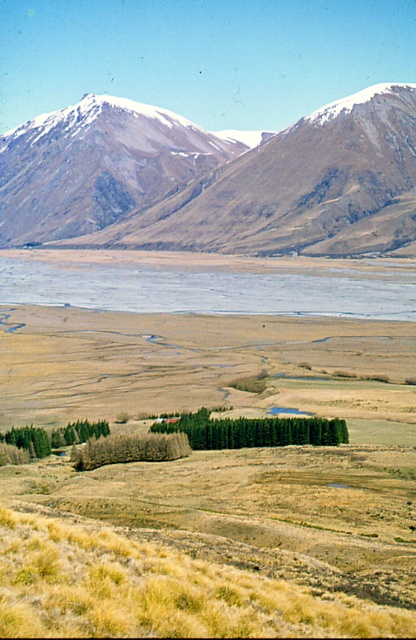
Question: Which point is closer to the camera?

Choices:
 (A) (143, 291)
 (B) (408, 92)
 (C) (173, 404)

Answer: (C)

Question: Is dry grassland at center positioned in front of blue water at center?

Choices:
 (A) no
 (B) yes

Answer: (B)

Question: Is dry grassland at center closer to camera compared to snowy rocky mountain range at upper center?

Choices:
 (A) no
 (B) yes

Answer: (B)

Question: Estimate the real-world distances between objects in this image. Which object is farther from the snowy rocky mountain range at upper center?

Choices:
 (A) blue water at center
 (B) dry grassland at center

Answer: (B)

Question: Estimate the real-world distances between objects in this image. Which object is closer to the dry grassland at center?

Choices:
 (A) blue water at center
 (B) snowy rocky mountain range at upper center

Answer: (A)

Question: Does dry grassland at center have a lesser width compared to snowy rocky mountain range at upper center?

Choices:
 (A) no
 (B) yes

Answer: (B)